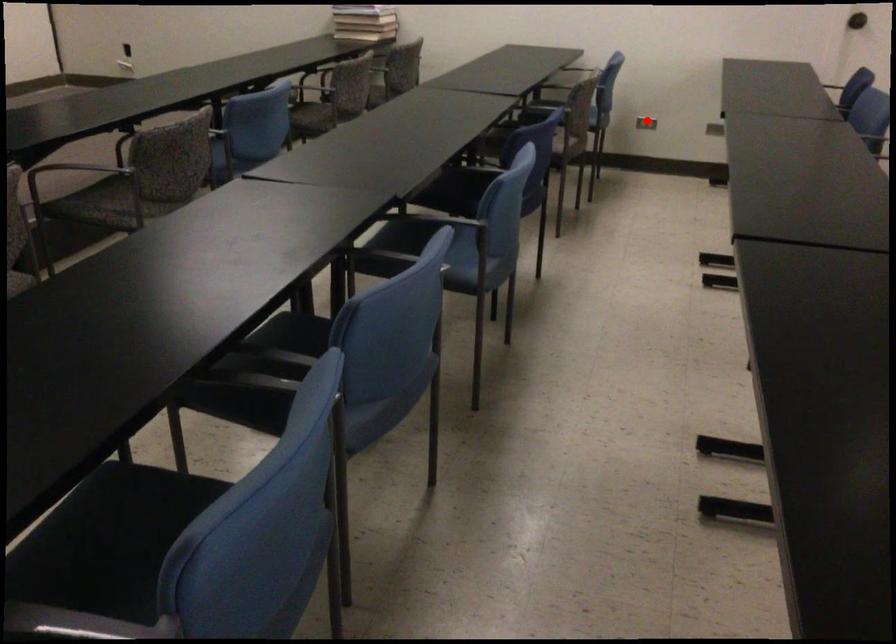
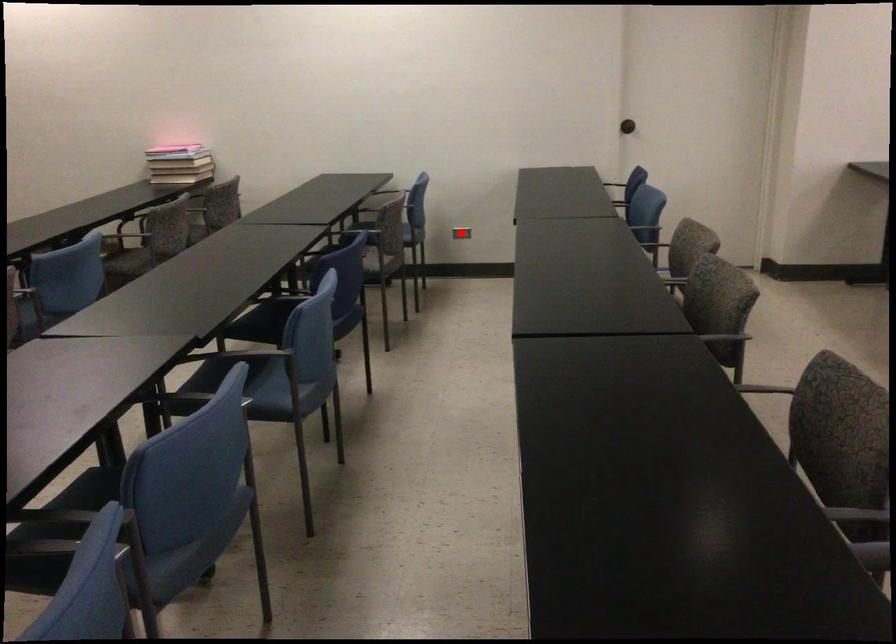
In the scene shown: I am providing you with two images of the same scene from different viewpoints. A red point is marked on the first image and another point is marked on the second image. Is the red point in image1 aligned with the point shown in image2?

Yes